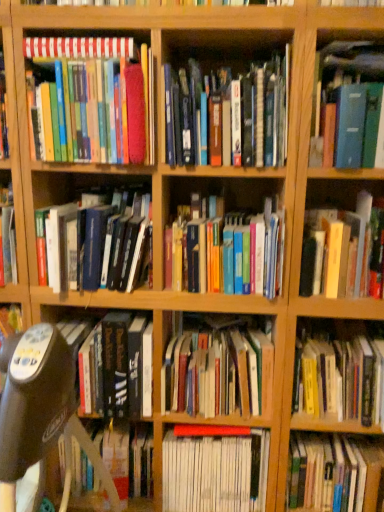
Question: Do you think hardcover books at center, which is counted as the 5th book, starting from the top, is within hardcover book at left, positioned as the 9th book in bottom-to-top order, or outside of it?

Choices:
 (A) outside
 (B) inside

Answer: (A)

Question: Considering the relative positions of hardcover books at center, which is counted as the 5th book, starting from the top, and hardcover book at left, the fourth book when ordered from top to bottom, in the image provided, is hardcover books at center, which is counted as the 5th book, starting from the top, to the left or to the right of hardcover book at left, the fourth book when ordered from top to bottom,?

Choices:
 (A) left
 (B) right

Answer: (B)

Question: Which is farther from the hardcover books at center, which is the twelfth book from bottom to top?

Choices:
 (A) hardcover book at center, which is counted as the 3th book, starting from the bottom
 (B) black plastic swivel chair at center-left
 (C) matte hardcover books at upper left, marked as the second book in a top-to-bottom arrangement
 (D) hardcover books at center, positioned as the 5th book in bottom-to-top order
 (E) hardcover books at center, the eighth book from the bottom

Answer: (A)

Question: Which object is the closest to the matte hardcover books at upper left, marked as the second book in a top-to-bottom arrangement?

Choices:
 (A) hardcover book at left, positioned as the 9th book in bottom-to-top order
 (B) hardcover book at center, which is counted as the 3th book, starting from the bottom
 (C) hardcover books at center, the 8th book viewed from the top
 (D) hardcover books at center, which is the twelfth book from bottom to top
 (E) hardcover book at center, the sixth book ordered from the bottom

Answer: (D)